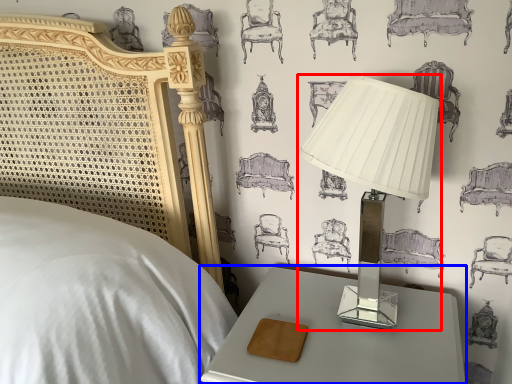
Question: Which of the following is the farthest to the observer, lamp (highlighted by a red box) or nightstand (highlighted by a blue box)?

Choices:
 (A) lamp
 (B) nightstand

Answer: (B)